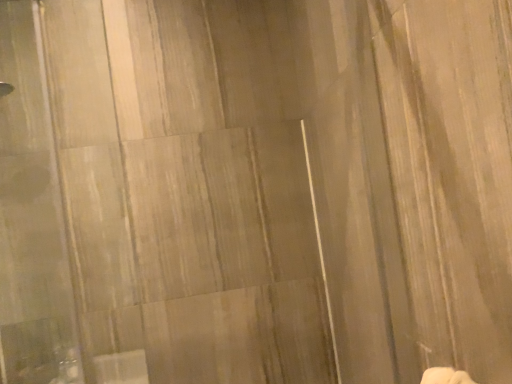
What are the coordinates of `transparent glass door at left` in the screenshot? It's located at (32, 217).

What is the approximate width of transparent glass door at left?

transparent glass door at left is 7.82 inches wide.

Image resolution: width=512 pixels, height=384 pixels. What do you see at coordinates (32, 217) in the screenshot?
I see `transparent glass door at left` at bounding box center [32, 217].

Locate an element on the screen. transparent glass door at left is located at coordinates (32, 217).